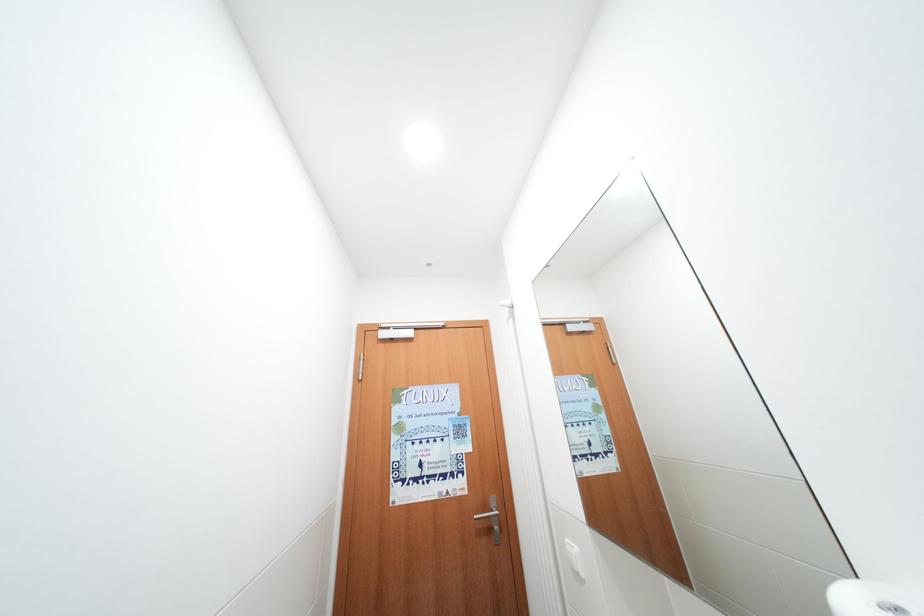
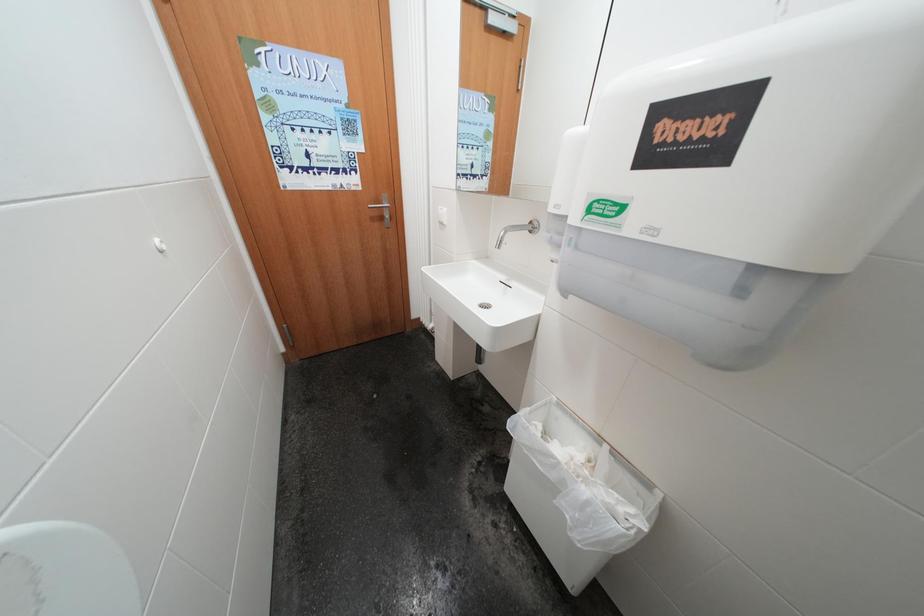
Based on the continuous images, in which direction is the camera rotating?

The rotation direction of the camera is right-down.